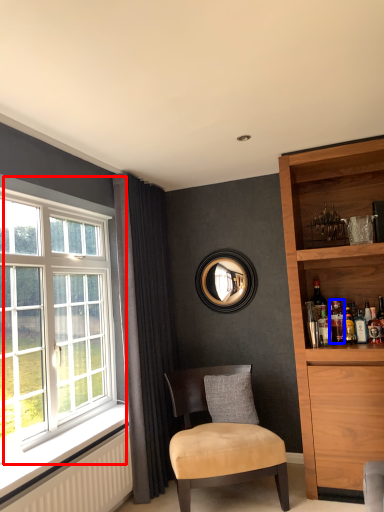
Question: Among these objects, which one is farthest to the camera, window (highlighted by a red box) or beverage (highlighted by a blue box)?

Choices:
 (A) window
 (B) beverage

Answer: (B)